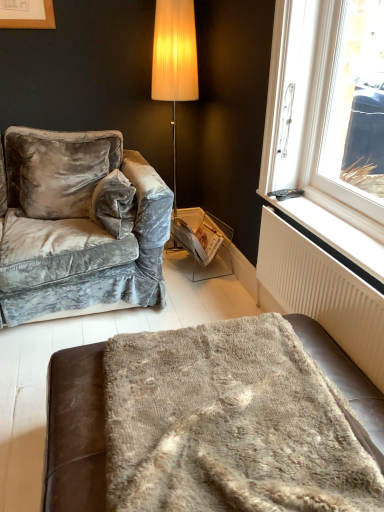
This screenshot has width=384, height=512. Find the location of `free point below white plastic window at upper right (from a real-world perspective)`. free point below white plastic window at upper right (from a real-world perspective) is located at coordinates (322, 222).